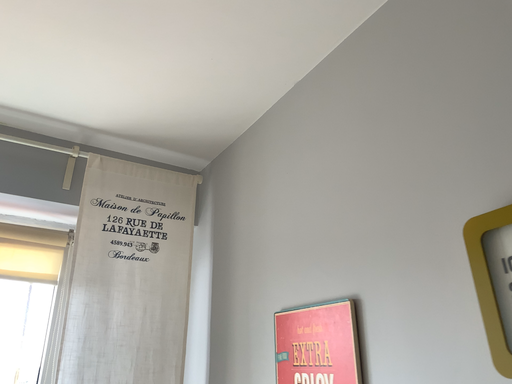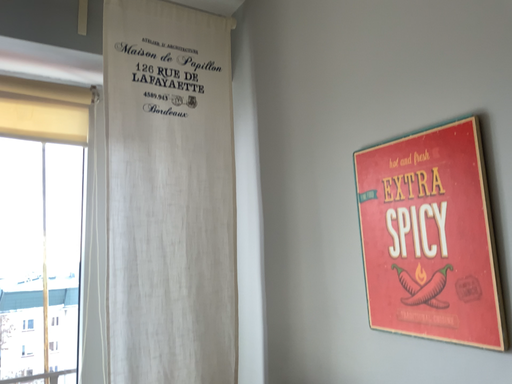
Question: How did the camera likely rotate when shooting the video?

Choices:
 (A) rotated downward
 (B) rotated upward

Answer: (A)